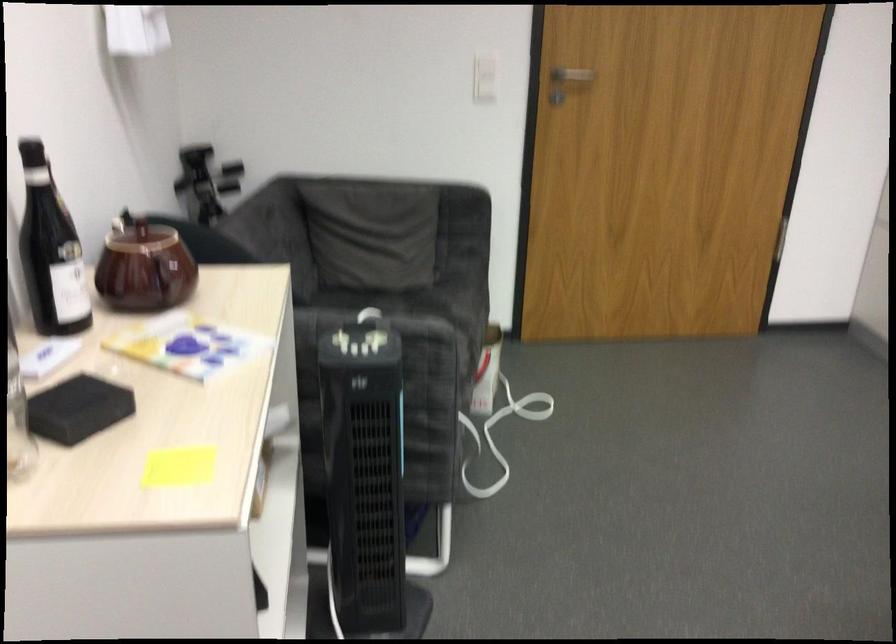
Where is `metal door handle`? This screenshot has height=644, width=896. metal door handle is located at coordinates (569, 77).